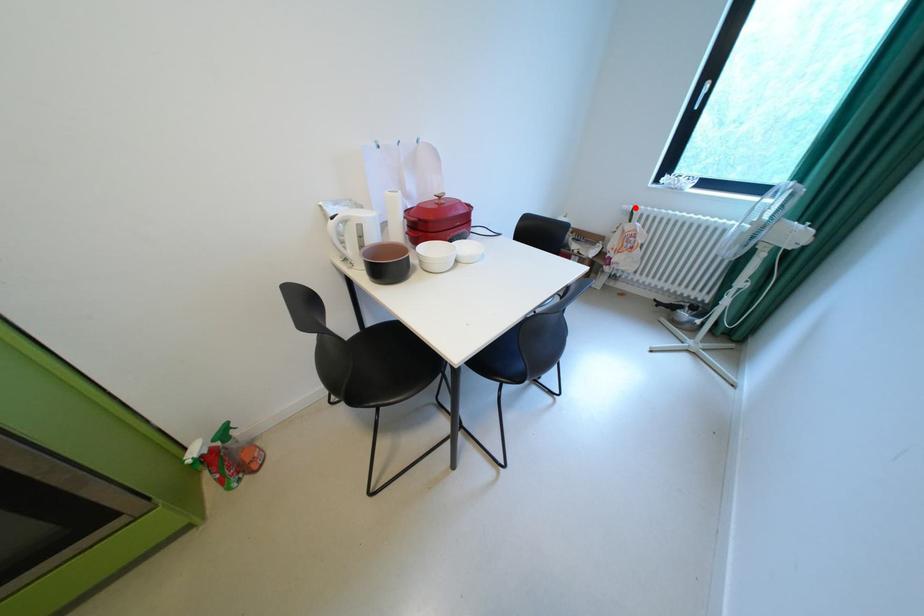
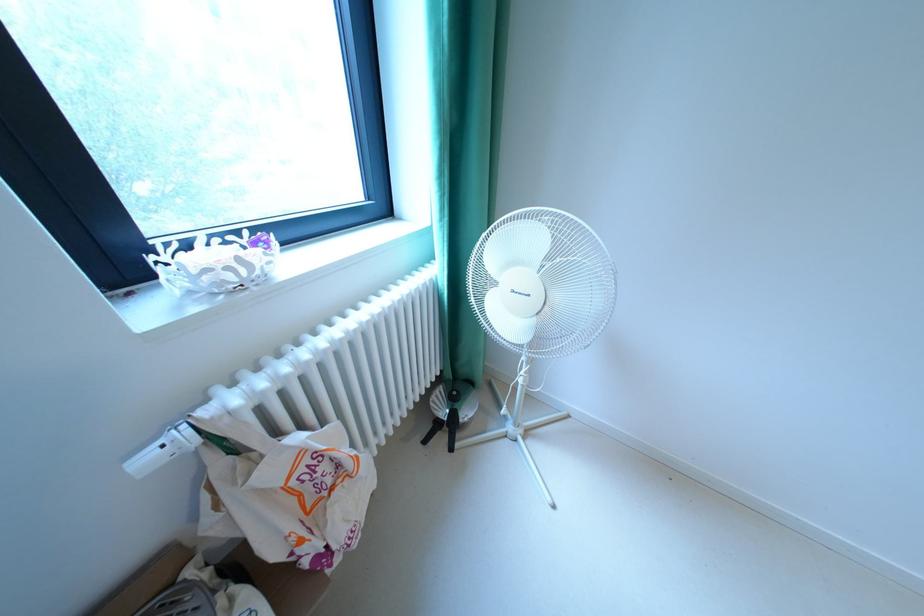
Question: I am providing you with two images of the same scene from different viewpoints. In image1, a red point is highlighted. Considering the same 3D point in image2, which of the following is correct?

Choices:
 (A) It is closer
 (B) It is farther

Answer: (B)